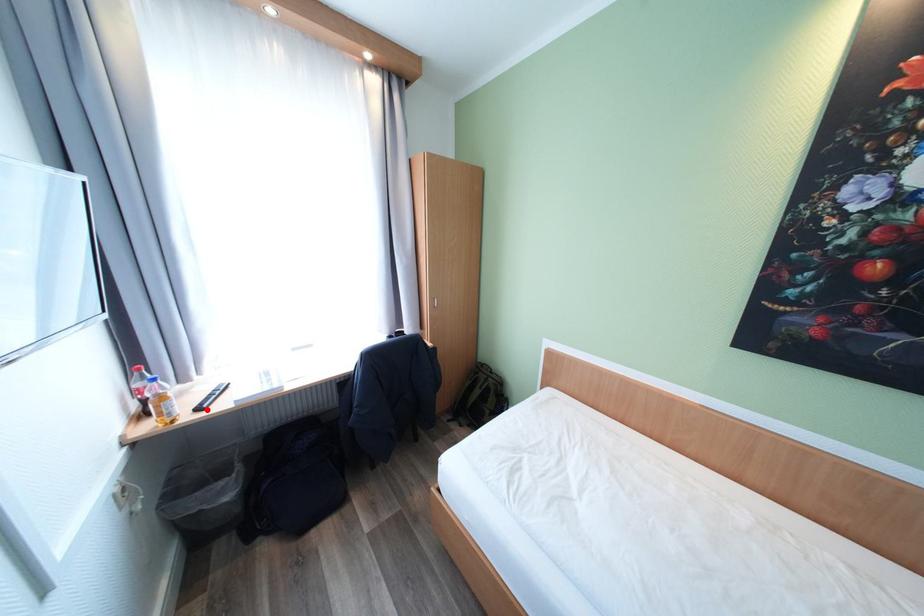
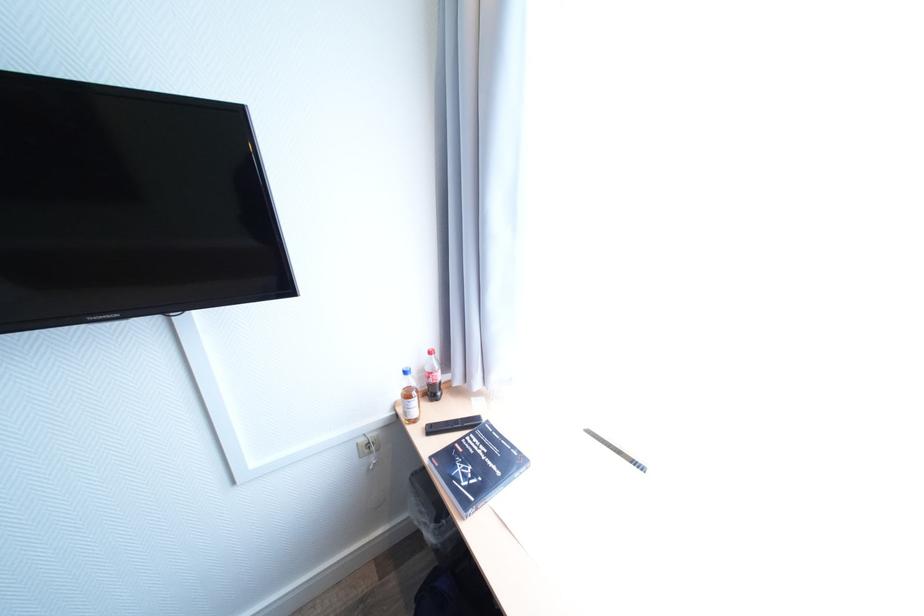
The point at the highlighted location is marked in the first image. Where is the corresponding point in the second image?

(439, 430)